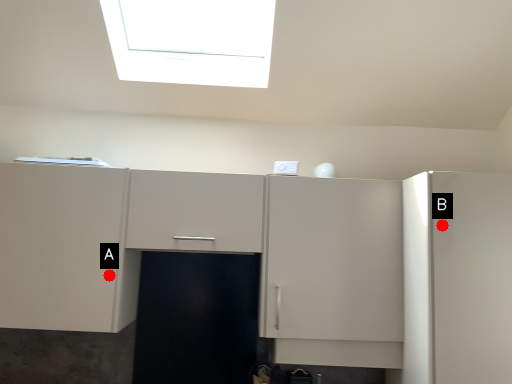
Question: Two points are circled on the image, labeled by A and B beside each circle. Which point is further to the camera?

Choices:
 (A) A is further
 (B) B is further

Answer: (A)